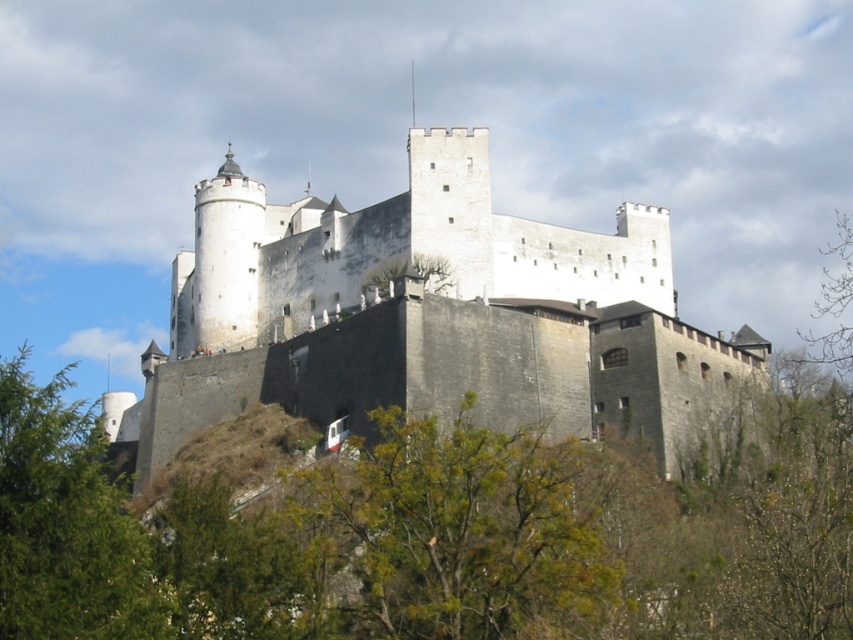
Is point (317, 268) more distant than point (38, 598)?

Yes, point (317, 268) is behind point (38, 598).

Locate an element on the screen. white stone castle at center is located at coordinates (426, 316).

The height and width of the screenshot is (640, 853). I want to click on white stone castle at center, so click(426, 316).

Which is more to the left, white stone castle at center or green leafy tree at lower center?

white stone castle at center is more to the left.

Where is `white stone castle at center`? Image resolution: width=853 pixels, height=640 pixels. white stone castle at center is located at coordinates (426, 316).

Is point (625, 273) less distant than point (462, 486)?

No, it is not.

Locate an element on the screen. The width and height of the screenshot is (853, 640). white stone castle at center is located at coordinates (426, 316).

Consider the image. Can you confirm if green leafy tree at lower center is positioned below green leafy tree at lower left?

Yes.

Measure the distance between point (541, 465) and camera.

The distance of point (541, 465) from camera is 65.32 meters.

Which is in front, point (372, 531) or point (80, 614)?

Point (80, 614) is more forward.

This screenshot has width=853, height=640. I want to click on green leafy tree at lower center, so click(451, 532).